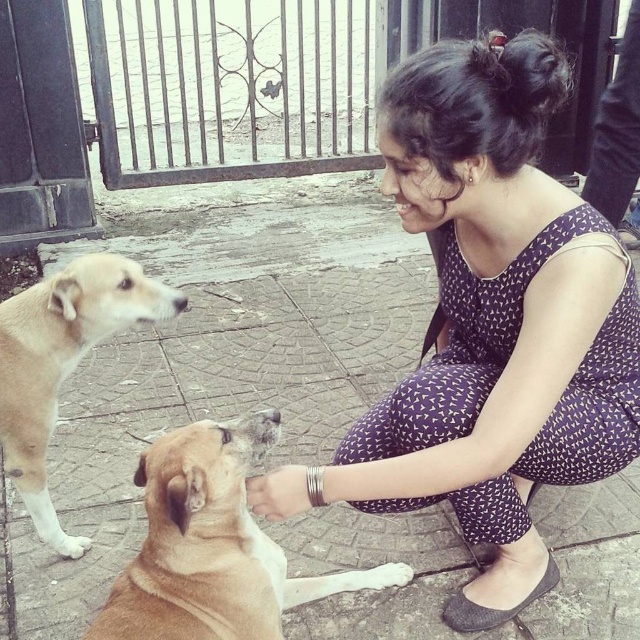
Is point (176, 548) closer to camera compared to point (51, 280)?

Yes, point (176, 548) is closer to viewer.

Does point (275, 572) lie behind point (35, 422)?

No, (275, 572) is closer to viewer.

Locate an element on the screen. brown furry dog at lower left is located at coordinates (208, 545).

Between brown furry dog at lower left and white fur paw at lower center, which one is positioned higher?

brown furry dog at lower left is higher up.

Identify the location of brown furry dog at lower left. (208, 545).

Is purple printed dress at center bigger than white fur paw at lower left?

Indeed, purple printed dress at center has a larger size compared to white fur paw at lower left.

Is purple printed dress at center shorter than white fur paw at lower left?

No, purple printed dress at center is not shorter than white fur paw at lower left.

Is point (540, 97) closer to viewer compared to point (60, 544)?

Yes, point (540, 97) is closer to viewer.

In order to click on purple printed dress at center in this screenshot , I will do `click(496, 321)`.